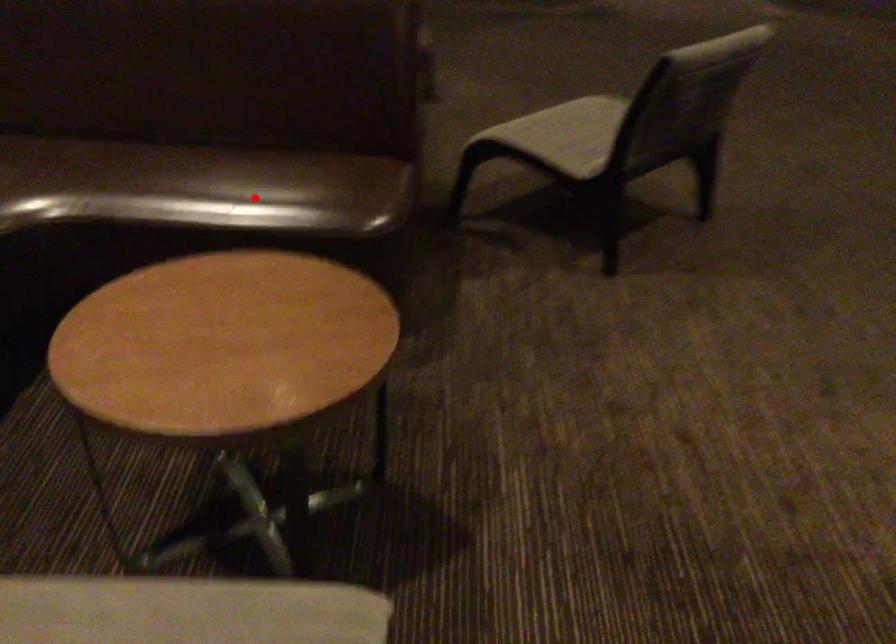
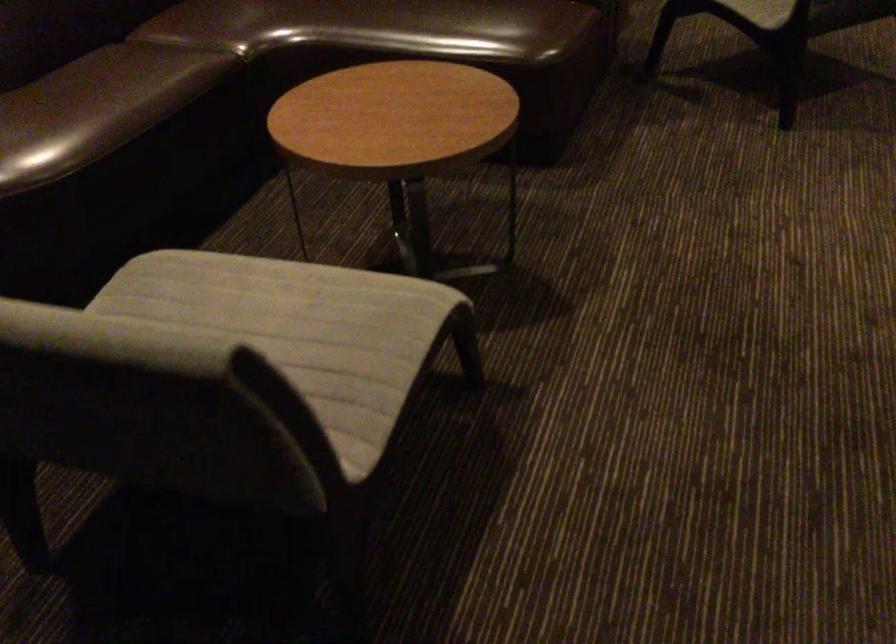
Question: A red point is marked in image1. In image2, is the corresponding 3D point closer to the camera or farther? Reply with the corresponding letter.

Choices:
 (A) The corresponding 3D point is closer.
 (B) The corresponding 3D point is farther.

Answer: (B)